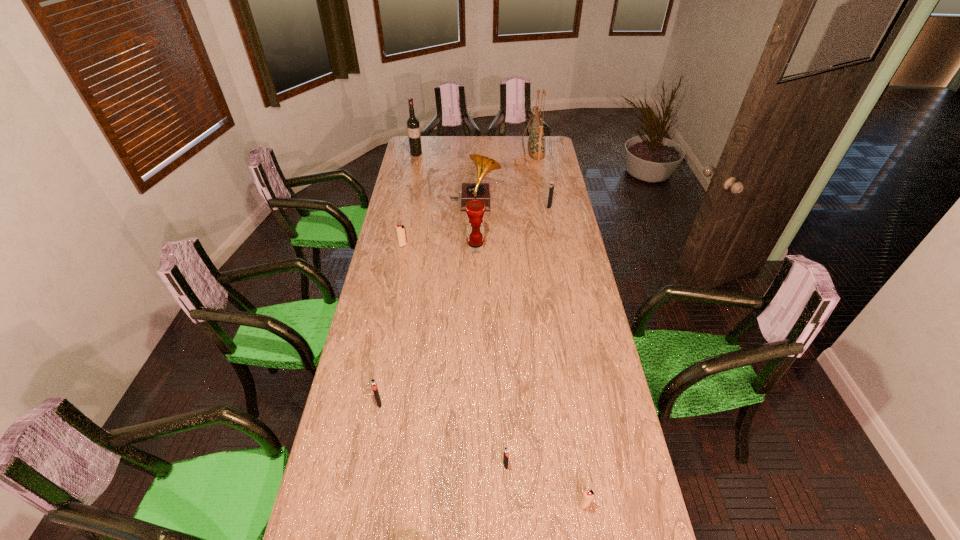
The image size is (960, 540). I want to click on vacant area situated 0.050m from the horn of the third tallest object, so click(510, 204).

Where is `vacant area located 0.220m on the right of the condiment`? This screenshot has width=960, height=540. vacant area located 0.220m on the right of the condiment is located at coordinates click(x=533, y=248).

Image resolution: width=960 pixels, height=540 pixels. Identify the location of free spot located 0.070m on the left of the biggest black igniter. (533, 207).

Where is `free space located 0.090m on the back of the second nearest black igniter`? free space located 0.090m on the back of the second nearest black igniter is located at coordinates (384, 375).

At what (x,y) coordinates should I click in order to perform the action: click on vacant space situated on the right of the bigger red igniter. Please return your answer as a coordinate pair (x, y). Looking at the image, I should click on (419, 245).

Locate an element on the screen. Image resolution: width=960 pixels, height=540 pixels. free location located 0.060m on the right of the smaller red igniter is located at coordinates (612, 504).

Where is `vacant space located 0.160m on the right of the eighth farthest object`? The width and height of the screenshot is (960, 540). vacant space located 0.160m on the right of the eighth farthest object is located at coordinates (561, 464).

Locate an element on the screen. handbag that is at the far edge is located at coordinates (536, 143).

I want to click on wine bottle that is at the far edge, so tap(413, 127).

The image size is (960, 540). Find the location of `wine bottle located at the left edge`. wine bottle located at the left edge is located at coordinates (413, 127).